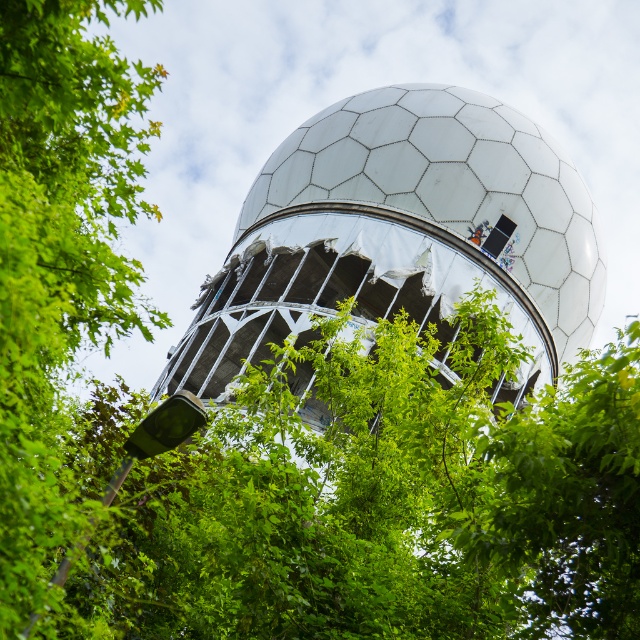
Question: Based on their relative distances, which object is nearer to the white hexagonal dome at center?

Choices:
 (A) green leafy tree at upper left
 (B) green leafy tree at center

Answer: (B)

Question: Which object is farther from the camera taking this photo?

Choices:
 (A) green leafy tree at upper left
 (B) green leafy tree at center
 (C) white hexagonal dome at center

Answer: (C)

Question: Is green leafy tree at upper left to the left of green leafy tree at center from the viewer's perspective?

Choices:
 (A) yes
 (B) no

Answer: (A)

Question: Which point appears farthest from the camera in this image?

Choices:
 (A) (588, 588)
 (B) (198, 339)
 (C) (54, 406)

Answer: (B)

Question: Does green leafy tree at upper left appear on the left side of green leafy tree at center?

Choices:
 (A) yes
 (B) no

Answer: (A)

Question: Is white hexagonal dome at center wider than green leafy tree at center?

Choices:
 (A) yes
 (B) no

Answer: (A)